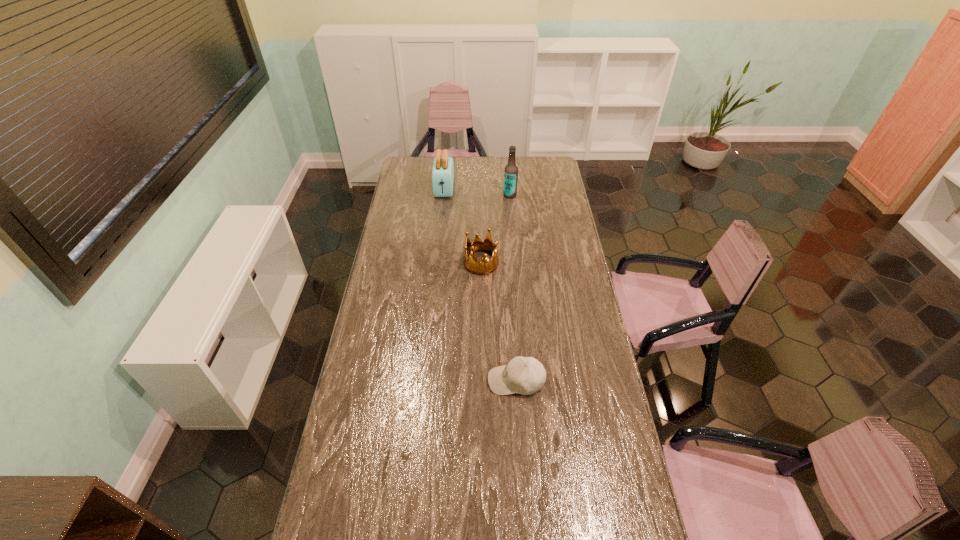
Where is `beer bottle`? beer bottle is located at coordinates (511, 170).

Locate an element on the screen. the leftmost object is located at coordinates (443, 167).

Locate an element on the screen. This screenshot has width=960, height=540. the second tallest object is located at coordinates (443, 167).

Locate an element on the screen. the third farthest object is located at coordinates (471, 264).

You are a GUI agent. You are given a task and a screenshot of the screen. Output one action in this format:
    pyautogui.click(x=<x>, y=<y>)
    Task: Click on the crown
    
    Given the screenshot: What is the action you would take?
    pyautogui.click(x=471, y=264)

Image resolution: width=960 pixels, height=540 pixels. Identify the location of baseball cap. (524, 375).

You are a GUI agent. You are given a task and a screenshot of the screen. Output one action in this format:
    pyautogui.click(x=<x>, y=<y>)
    Task: Click on the nearest object
    The width and height of the screenshot is (960, 540).
    Given the screenshot: What is the action you would take?
    pyautogui.click(x=524, y=375)

The height and width of the screenshot is (540, 960). I want to click on free spot located 0.380m on the side of the tallest object with the label, so click(x=435, y=195).

Image resolution: width=960 pixels, height=540 pixels. Find the location of `free point located 0.320m on the side of the tallest object with the label`. free point located 0.320m on the side of the tallest object with the label is located at coordinates (445, 195).

Image resolution: width=960 pixels, height=540 pixels. I want to click on free space located on the side of the tallest object with the label, so click(478, 195).